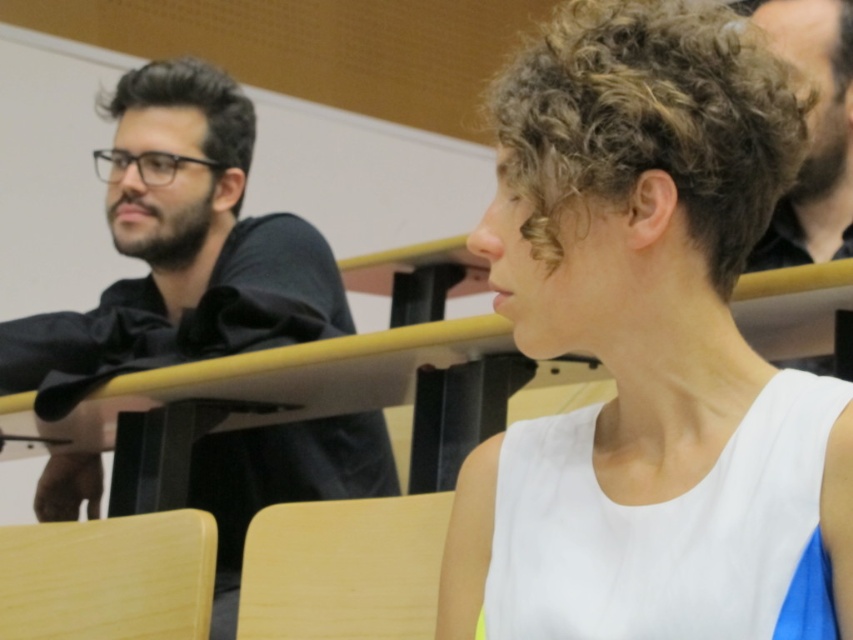
You are standing in the classroom and want to reach the point at coordinates point (733, 67). If your arm can reach 30 inches, can you touch the point without moving your feet?

The point (733, 67) is 32.48 inches away from you, which is beyond your 30 inches reach. You cannot touch it without moving your feet.

You are a classroom assistant who needs to pass out materials. You are standing at the front of the classroom. The black matte shirt at left and dark brown curly hair at upper right are both students who need a handout. Which student should you approach first to ensure you can reach them without moving too far from your current position?

You should approach the black matte shirt at left first because it is closer to you at the front of the classroom compared to the dark brown curly hair at upper right, which is 1.01 meters away from the black matte shirt at left, implying it is further back.